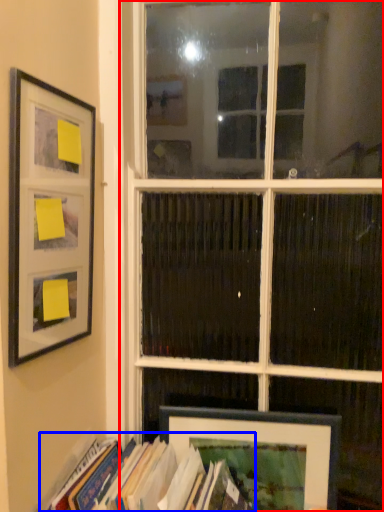
Question: Which of the following is the farthest to the observer, window (highlighted by a red box) or book (highlighted by a blue box)?

Choices:
 (A) window
 (B) book

Answer: (A)